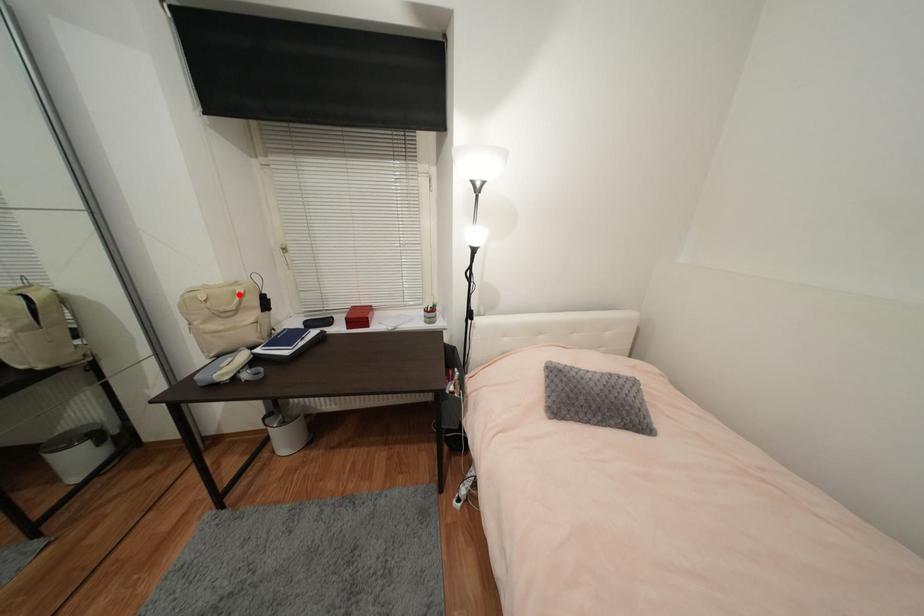
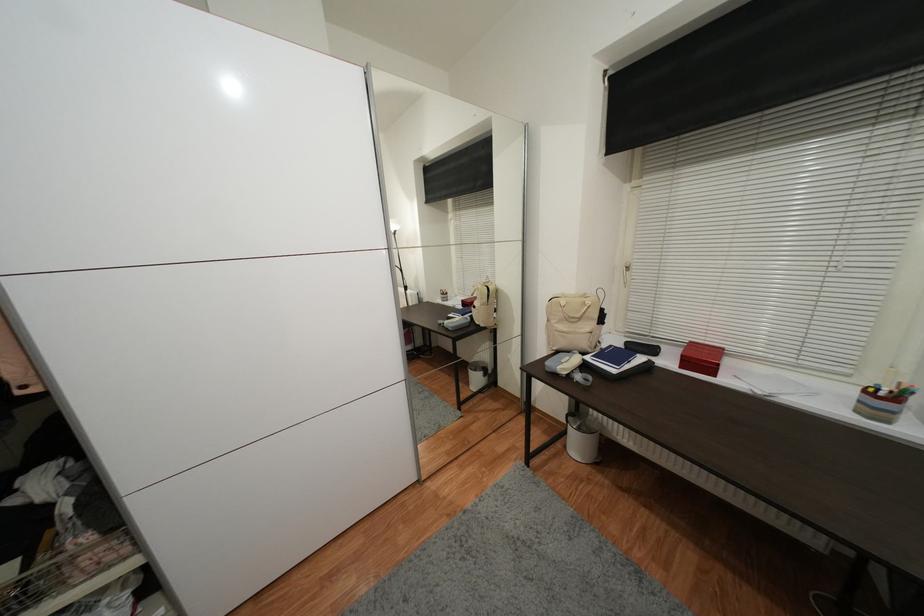
Locate, in the second image, the point that corresponds to the highlighted location in the first image.

(589, 305)